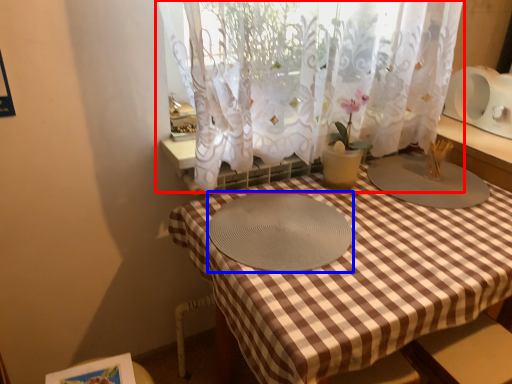
Question: Among these objects, which one is nearest to the camera, curtain (highlighted by a red box) or glass plate (highlighted by a blue box)?

Choices:
 (A) curtain
 (B) glass plate

Answer: (A)